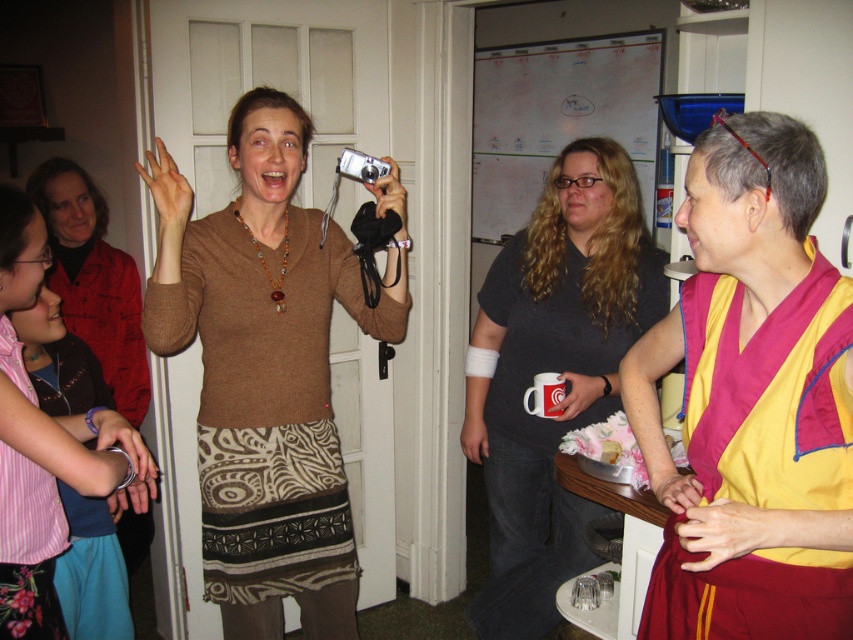
You are standing in the room and want to move from the point at coordinates point (x=793, y=474) to the point at coordinates point (x=321, y=275). Which direction should you move to reach your destination?

To move from point (x=793, y=474) to point (x=321, y=275), you should move backward since point (x=793, y=474) is in front of point (x=321, y=275).

You are standing in the room where the gathering is happening. You notice two points marked on the whiteboard. The first point is at coordinates point [784,157] and the second is at point [346,154]. If you were to walk towards the whiteboard, which point would appear closer to you as you approach?

Point [784,157] is closer to the camera than point [346,154], so as you approach the whiteboard, the point at point [784,157] will appear closer to you.